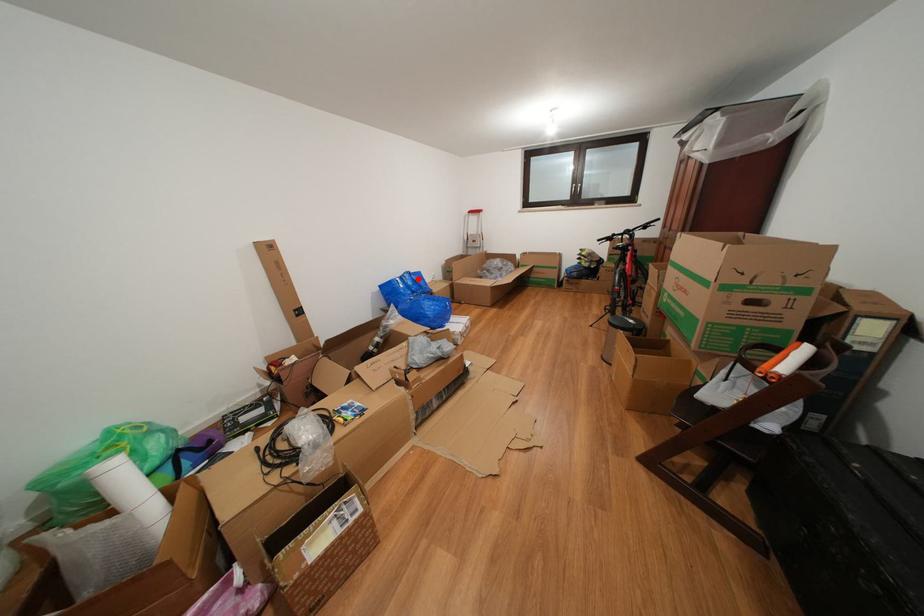
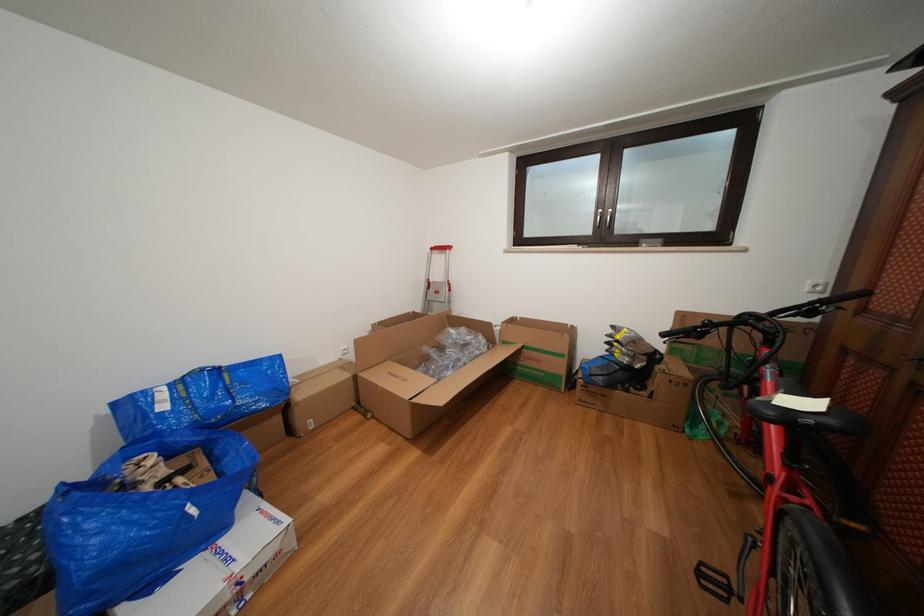
Find the pixel in the second image that matches the highlighted location in the first image.

(225, 376)